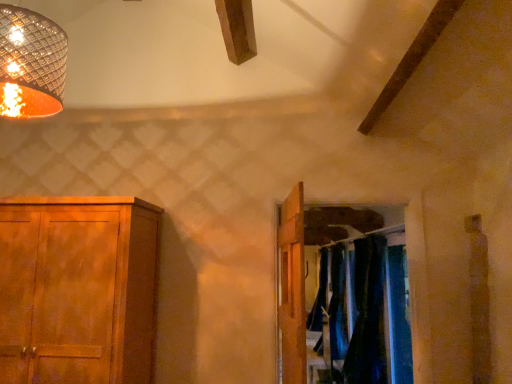
Question: Considering the relative positions of metallic woven shade at upper left and velvet dark blue curtains at right, marked as the second curtain in a back-to-front arrangement, in the image provided, is metallic woven shade at upper left in front of velvet dark blue curtains at right, marked as the second curtain in a back-to-front arrangement,?

Choices:
 (A) yes
 (B) no

Answer: (A)

Question: Is metallic woven shade at upper left wider than velvet dark blue curtains at right, marked as the second curtain in a back-to-front arrangement?

Choices:
 (A) yes
 (B) no

Answer: (B)

Question: From a real-world perspective, is metallic woven shade at upper left on velvet dark blue curtains at right, marked as the second curtain in a back-to-front arrangement?

Choices:
 (A) yes
 (B) no

Answer: (A)

Question: Can you confirm if metallic woven shade at upper left is positioned to the left of velvet dark blue curtains at right, which is the 1th curtain in front-to-back order?

Choices:
 (A) no
 (B) yes

Answer: (B)

Question: From a real-world perspective, is metallic woven shade at upper left positioned under velvet dark blue curtains at right, which is the 1th curtain in front-to-back order, based on gravity?

Choices:
 (A) no
 (B) yes

Answer: (A)

Question: Does metallic woven shade at upper left have a greater height compared to velvet dark blue curtains at right, which is the 1th curtain in front-to-back order?

Choices:
 (A) yes
 (B) no

Answer: (B)

Question: Is wooden door at center surrounded by dark blue fabric at center?

Choices:
 (A) yes
 (B) no

Answer: (B)

Question: Considering the relative positions of dark blue fabric at center and wooden door at center in the image provided, is dark blue fabric at center to the left of wooden door at center from the viewer's perspective?

Choices:
 (A) yes
 (B) no

Answer: (B)

Question: From the image's perspective, is dark blue fabric at center above wooden door at center?

Choices:
 (A) yes
 (B) no

Answer: (B)

Question: Is dark blue fabric at center at the right side of wooden door at center?

Choices:
 (A) no
 (B) yes

Answer: (B)

Question: Would you say dark blue fabric at center is outside wooden door at center?

Choices:
 (A) no
 (B) yes

Answer: (B)

Question: Does dark blue fabric at center have a lesser width compared to wooden door at center?

Choices:
 (A) yes
 (B) no

Answer: (A)

Question: Is dark blue fabric at center outside of metallic woven shade at upper left?

Choices:
 (A) no
 (B) yes

Answer: (B)